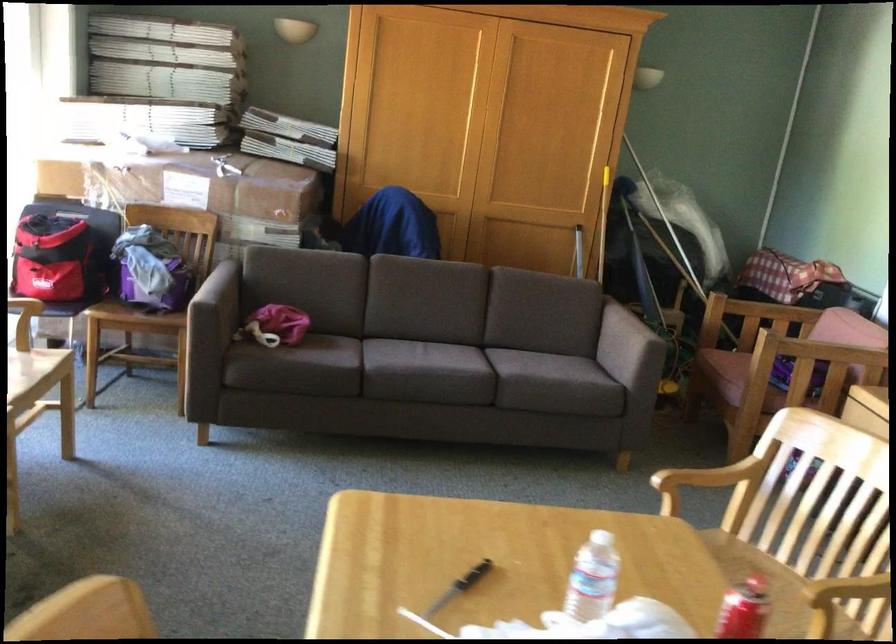
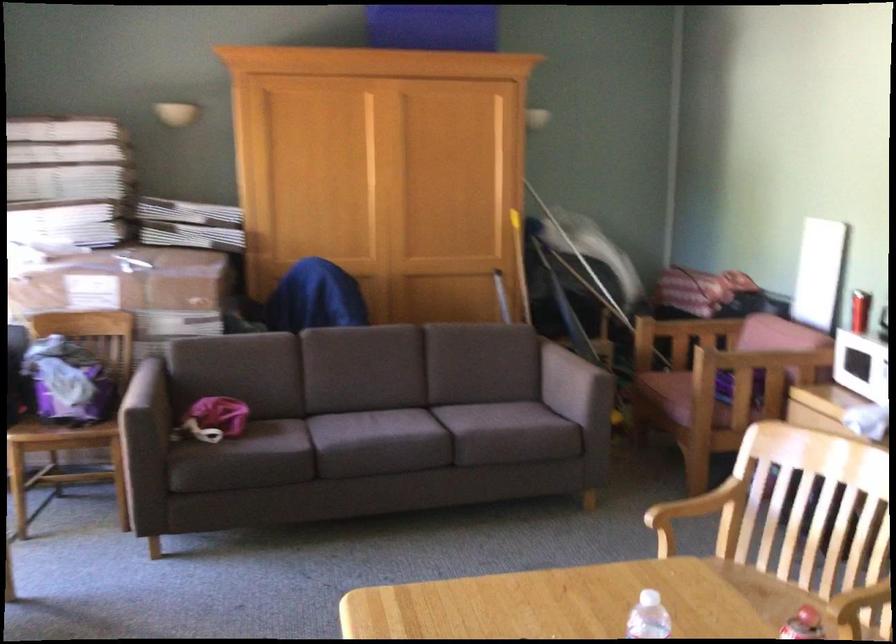
In the second image, find the point that corresponds to [728,368] in the first image.

(669, 393)